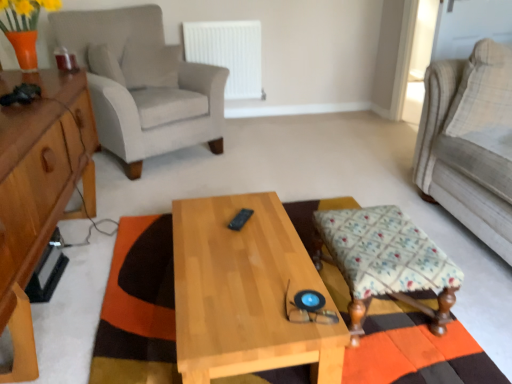
Locate an element on the screen. The width and height of the screenshot is (512, 384). vacant space to the left of light wood/texture coffee table at center is located at coordinates (117, 292).